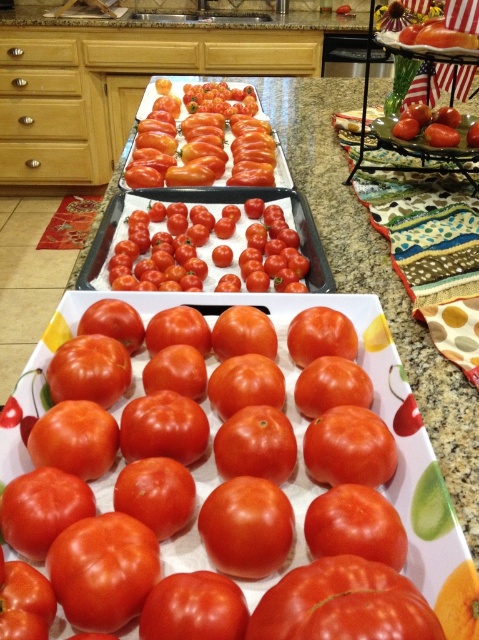
Can you confirm if shiny red tomato at center is thinner than shiny red tomatoes at center?

Yes.

Which of these two, shiny red tomato at center or shiny red tomatoes at center, stands shorter?

shiny red tomato at center is shorter.

Find the location of a particular element. shiny red tomato at center is located at coordinates (207, 248).